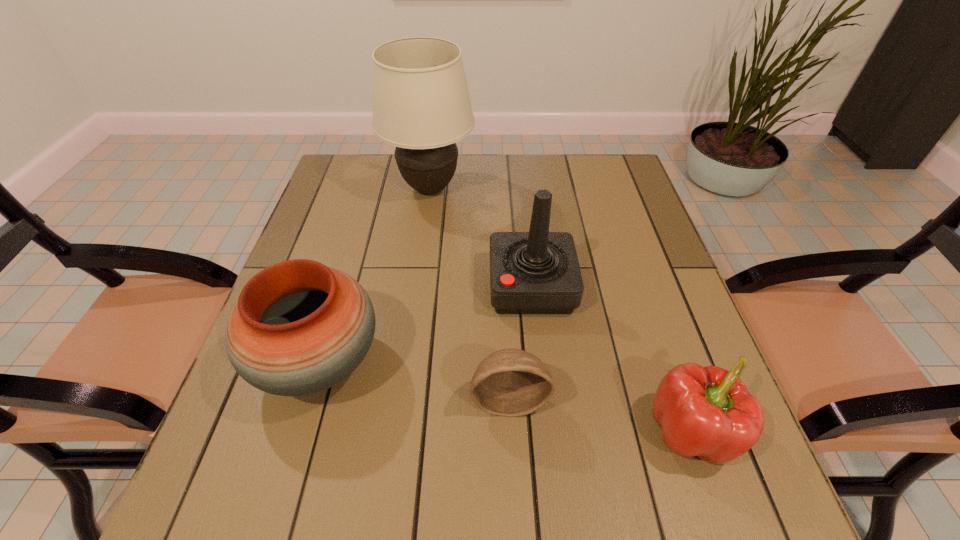
Locate an element on the screen. vacant space situated 0.380m on the right of the pottery is located at coordinates (571, 362).

This screenshot has width=960, height=540. What are the coordinates of `free space located on the left of the pepper` in the screenshot? It's located at (537, 431).

Identify the location of vacant area located 0.260m on the back of the bowl. This screenshot has width=960, height=540. (503, 284).

The width and height of the screenshot is (960, 540). Identify the location of object that is at the far edge. (421, 104).

Where is `object that is at the near edge`? object that is at the near edge is located at coordinates (708, 412).

This screenshot has width=960, height=540. What are the coordinates of `object positioned at the left edge` in the screenshot? It's located at (299, 327).

Locate an element on the screen. This screenshot has width=960, height=540. object at the right edge is located at coordinates (708, 412).

Where is `object situated at the near right corner`? object situated at the near right corner is located at coordinates (708, 412).

In the image, there is a desktop. Where is `vacant space at the far edge`? This screenshot has width=960, height=540. vacant space at the far edge is located at coordinates (470, 180).

In the image, there is a desktop. Where is `free space at the near edge`? The height and width of the screenshot is (540, 960). free space at the near edge is located at coordinates (481, 507).